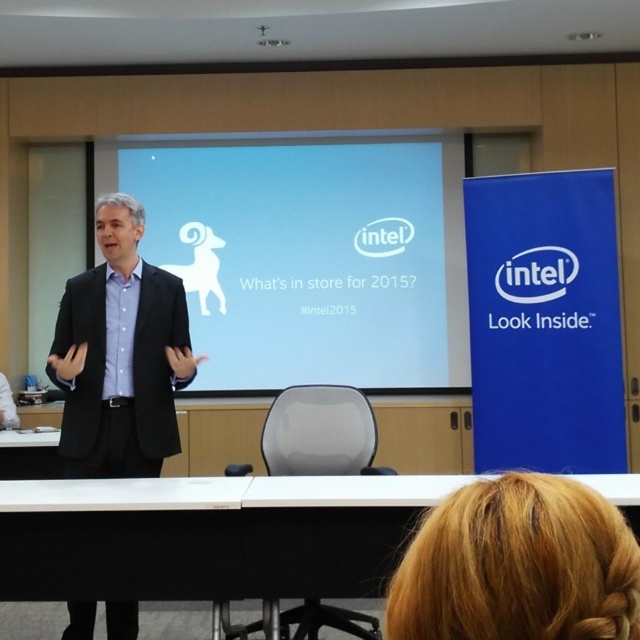
Can you confirm if blonde hair at upper right is positioned above black suit at center?

Incorrect, blonde hair at upper right is not positioned above black suit at center.

Is blonde hair at upper right further to camera compared to black suit at center?

No, it is in front of black suit at center.

Is point (451, 525) positioned before point (148, 358)?

Yes, point (451, 525) is closer to viewer.

Locate an element on the screen. The image size is (640, 640). blonde hair at upper right is located at coordinates (516, 564).

What are the coordinates of `white glossy screen at center` in the screenshot? It's located at (308, 257).

Where is `white glossy screen at center`? Image resolution: width=640 pixels, height=640 pixels. white glossy screen at center is located at coordinates (308, 257).

Does point (432, 230) come behind point (172, 339)?

Yes.

Can you confirm if white glossy screen at center is shorter than black suit at center?

In fact, white glossy screen at center may be taller than black suit at center.

Who is more distant from viewer, (188, 227) or (65, 310)?

Positioned behind is point (188, 227).

Where is `white glossy screen at center`? This screenshot has height=640, width=640. white glossy screen at center is located at coordinates click(308, 257).